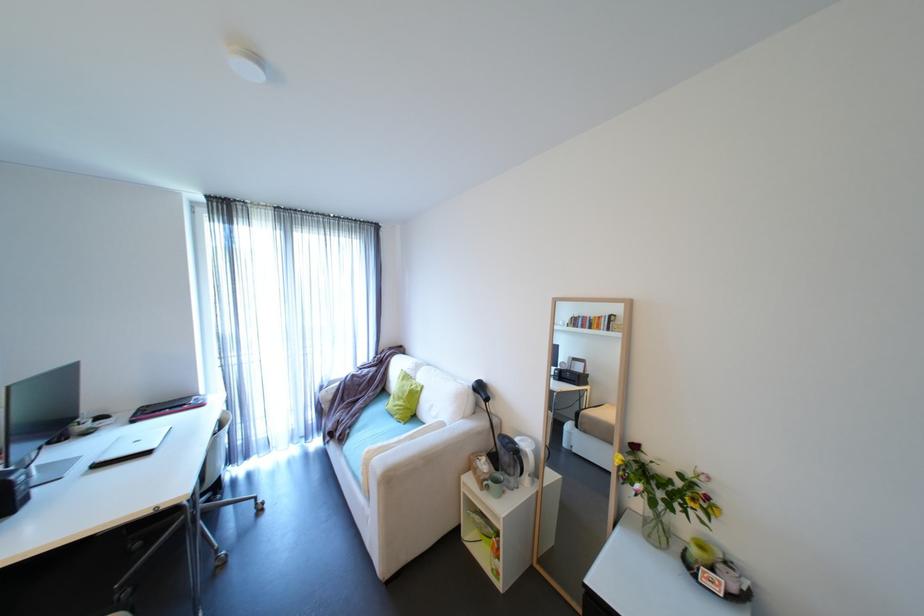
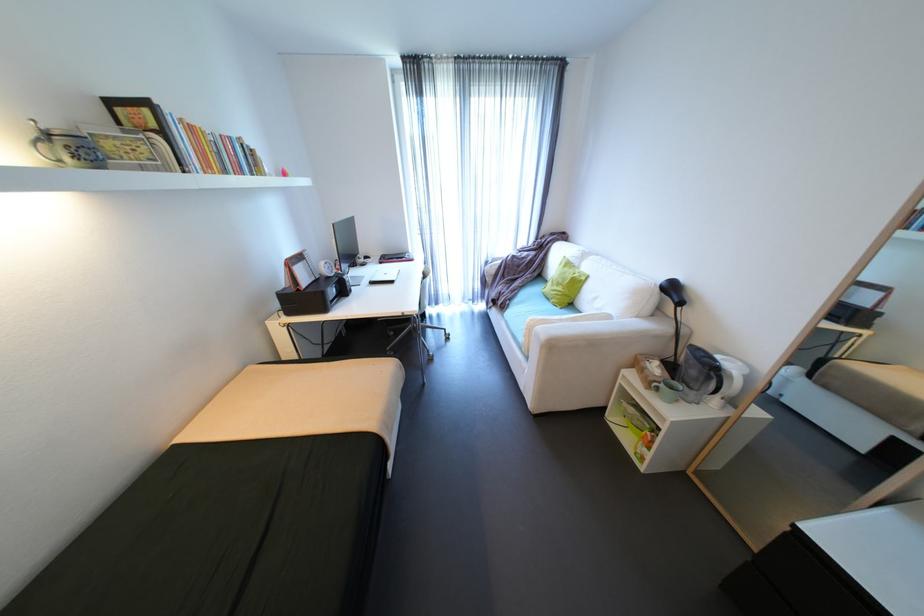
Based on the continuous images, in which direction is the camera rotating?

The rotation direction of the camera is left-down.